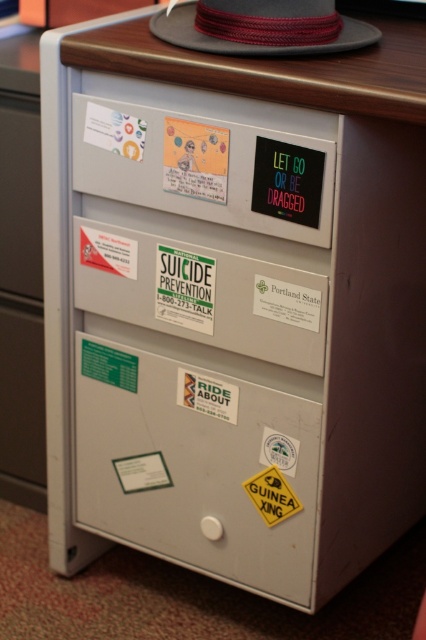
Does white matte drawer at center lie behind yellow paper sign at lower center?

No, white matte drawer at center is closer to the viewer.

Who is more forward, (249, 330) or (293, 504)?

Positioned in front is point (249, 330).

Which is in front, point (166, 323) or point (270, 486)?

Positioned in front is point (270, 486).

I want to click on white matte drawer at center, so click(x=201, y=294).

Is white matte drawer at center behind gray felt fedora at upper center?

That is True.

Is white matte drawer at center smaller than gray felt fedora at upper center?

No, white matte drawer at center is not smaller than gray felt fedora at upper center.

Is point (215, 321) positioned before point (291, 49)?

That is False.

Locate an element on the screen. The width and height of the screenshot is (426, 640). white matte drawer at center is located at coordinates (201, 294).

Can you confirm if gray felt fedora at upper center is smaller than yellow paper sign at lower center?

Incorrect, gray felt fedora at upper center is not smaller in size than yellow paper sign at lower center.

Which is in front, point (264, 10) or point (281, 502)?

Point (264, 10) is in front.

The height and width of the screenshot is (640, 426). Identify the location of gray felt fedora at upper center. (247, 36).